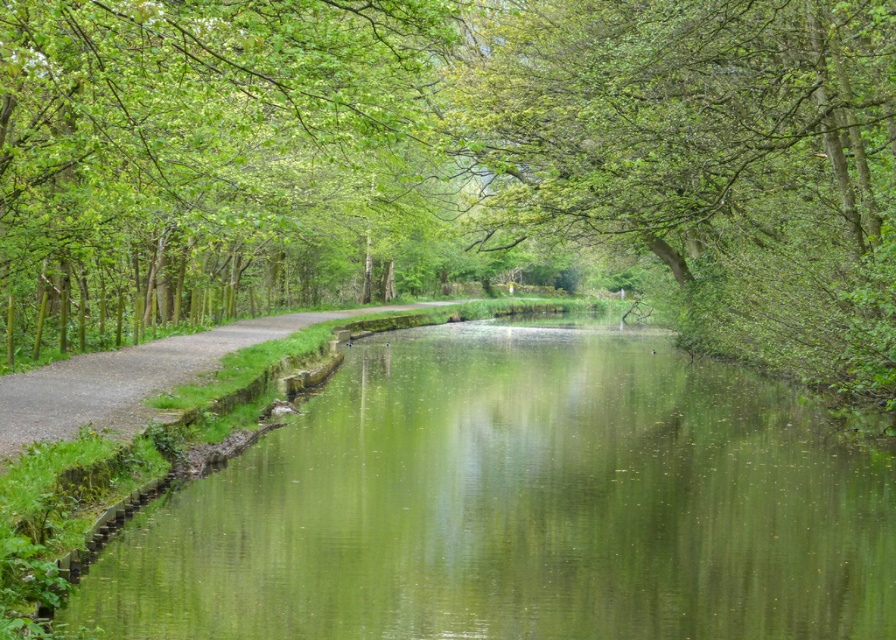
Who is more distant from viewer, [355,552] or [220,317]?

Point [220,317]

Can you confirm if green reflective water at center is taller than green leafy tree at upper left?

In fact, green reflective water at center may be shorter than green leafy tree at upper left.

Where is `green reflective water at center`? green reflective water at center is located at coordinates (521, 502).

Can you confirm if green leafy tree at center is wider than green reflective water at center?

Yes.

Between green leafy tree at center and green reflective water at center, which one appears on the left side from the viewer's perspective?

Positioned to the left is green reflective water at center.

What do you see at coordinates (454, 164) in the screenshot?
I see `green leafy tree at center` at bounding box center [454, 164].

Where is `green leafy tree at center`? green leafy tree at center is located at coordinates (454, 164).

Based on the photo, who is taller, green leafy tree at center or green leafy tree at upper left?

Standing taller between the two is green leafy tree at center.

Between point (685, 124) and point (444, 35), which one is positioned behind?

The point (685, 124) is more distant.

Is point (616, 45) closer to camera compared to point (459, 3)?

Yes.

The image size is (896, 640). I want to click on green leafy tree at center, so click(x=454, y=164).